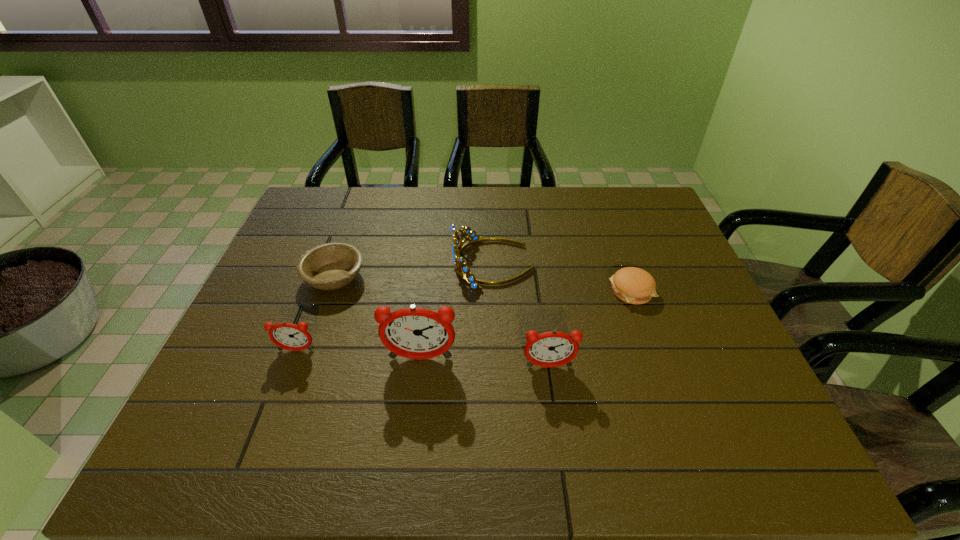
Locate an element on the screen. the shortest alarm clock is located at coordinates (288, 336).

This screenshot has width=960, height=540. What are the coordinates of `the leftmost alarm clock` in the screenshot? It's located at 288,336.

Find the location of a particular element. The image size is (960, 540). the tallest object is located at coordinates (416, 333).

Where is `the tallest alarm clock`? The image size is (960, 540). the tallest alarm clock is located at coordinates tap(416, 333).

Locate an element on the screen. This screenshot has width=960, height=540. the second tallest alarm clock is located at coordinates (549, 349).

Identify the location of patty. (633, 285).

This screenshot has width=960, height=540. Find the location of `tiara`. tiara is located at coordinates (463, 271).

Identify the location of bowl. click(x=333, y=265).

Find the location of `vacant space located on the front-facing side of the leftmost alarm clock`. vacant space located on the front-facing side of the leftmost alarm clock is located at coordinates click(284, 384).

At what (x,y) coordinates should I click in order to perform the action: click on vacant space located 0.100m on the front-facing side of the second alarm clock from right to left. Please return your answer as a coordinate pair (x, y). The width and height of the screenshot is (960, 540). Looking at the image, I should click on (415, 404).